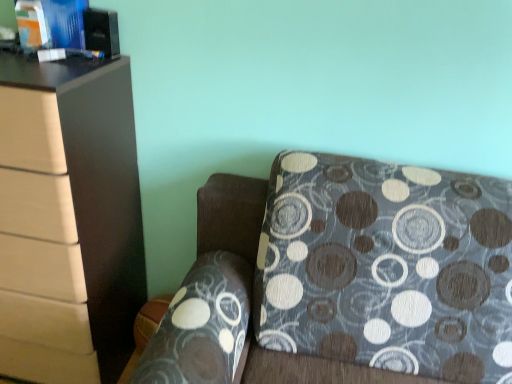
How much space does matte blue book at upper left, which is counted as the 2th book, starting from the right, occupy vertically?

The height of matte blue book at upper left, which is counted as the 2th book, starting from the right, is 5.12 inches.

What is the approximate width of matte blue book at upper left, which appears as the 1th book when viewed from the left?

The width of matte blue book at upper left, which appears as the 1th book when viewed from the left, is 1.79 inches.

Where is `patterned fabric couch at lower right`? patterned fabric couch at lower right is located at coordinates (346, 274).

Locate an element on the screen. The height and width of the screenshot is (384, 512). matte blue book at upper left, which appears as the 1th book when viewed from the left is located at coordinates (32, 25).

From the image's perspective, is blue glossy book at upper left, the 1th book from the right, positioned above or below matte brown chest of drawers at left?

blue glossy book at upper left, the 1th book from the right, is situated higher than matte brown chest of drawers at left in the image.

How different are the orientations of blue glossy book at upper left, the 1th book from the right, and matte brown chest of drawers at left in degrees?

The angle between the facing direction of blue glossy book at upper left, the 1th book from the right, and the facing direction of matte brown chest of drawers at left is 1.19e-05 degrees.

In order to click on the chest of drawers directly beneath the blue glossy book at upper left, the 2th book positioned from the left (from a real-world perspective) in this screenshot , I will do `click(87, 179)`.

Between blue glossy book at upper left, the 2th book positioned from the left, and matte brown chest of drawers at left, which one has larger size?

Bigger between the two is matte brown chest of drawers at left.

Considering the sizes of objects matte blue book at upper left, which appears as the 1th book when viewed from the left, and matte brown chest of drawers at left in the image provided, who is smaller, matte blue book at upper left, which appears as the 1th book when viewed from the left, or matte brown chest of drawers at left?

matte blue book at upper left, which appears as the 1th book when viewed from the left.

Is point (23, 0) farther from camera compared to point (88, 141)?

Yes, it is.

Is matte blue book at upper left, which appears as the 1th book when viewed from the left, far from matte brown chest of drawers at left?

No, there isn't a large distance between matte blue book at upper left, which appears as the 1th book when viewed from the left, and matte brown chest of drawers at left.

Which object is closer to the camera, matte brown chest of drawers at left or patterned fabric couch at lower right?

patterned fabric couch at lower right is closer to the camera.

Is matte brown chest of drawers at left next to patterned fabric couch at lower right and touching it?

No, matte brown chest of drawers at left is not next to patterned fabric couch at lower right.

Which is correct: matte brown chest of drawers at left is inside patterned fabric couch at lower right, or outside of it?

The correct answer is: outside.

From the picture: From a real-world perspective, is matte brown chest of drawers at left physically below patterned fabric couch at lower right?

Incorrect, from a real-world perspective, matte brown chest of drawers at left is higher than patterned fabric couch at lower right.

Based on the photo, can we say blue glossy book at upper left, the 1th book from the right, lies outside matte blue book at upper left, which appears as the 1th book when viewed from the left?

blue glossy book at upper left, the 1th book from the right, lies outside matte blue book at upper left, which appears as the 1th book when viewed from the left,'s area.

Is blue glossy book at upper left, the 2th book positioned from the left, not near matte blue book at upper left, which is counted as the 2th book, starting from the right?

blue glossy book at upper left, the 2th book positioned from the left, is near matte blue book at upper left, which is counted as the 2th book, starting from the right, not far away.

Does blue glossy book at upper left, the 1th book from the right, appear on the left side of matte blue book at upper left, which appears as the 1th book when viewed from the left?

No.

Is blue glossy book at upper left, the 2th book positioned from the left, facing towards matte blue book at upper left, which is counted as the 2th book, starting from the right?

Yes, blue glossy book at upper left, the 2th book positioned from the left, is oriented towards matte blue book at upper left, which is counted as the 2th book, starting from the right.

Find the location of a particular element. Image resolution: width=512 pixels, height=384 pixels. book that is above the matte blue book at upper left, which appears as the 1th book when viewed from the left (from a real-world perspective) is located at coordinates (51, 23).

From the image's perspective, is matte blue book at upper left, which appears as the 1th book when viewed from the left, above or below blue glossy book at upper left, the 2th book positioned from the left?

matte blue book at upper left, which appears as the 1th book when viewed from the left, is situated lower than blue glossy book at upper left, the 2th book positioned from the left, in the image.

Which is behind, matte brown chest of drawers at left or blue glossy book at upper left, the 1th book from the right?

blue glossy book at upper left, the 1th book from the right, is more distant.

From the image's perspective, is matte brown chest of drawers at left positioned above or below blue glossy book at upper left, the 2th book positioned from the left?

From the image's perspective, matte brown chest of drawers at left appears below blue glossy book at upper left, the 2th book positioned from the left.

Is point (53, 94) closer to viewer compared to point (45, 21)?

Yes.

I want to click on furniture below the blue glossy book at upper left, the 1th book from the right (from the image's perspective), so click(x=346, y=274).

Is patterned fabric couch at lower right not inside blue glossy book at upper left, the 1th book from the right?

Indeed, patterned fabric couch at lower right is completely outside blue glossy book at upper left, the 1th book from the right.

Considering the sizes of objects patterned fabric couch at lower right and blue glossy book at upper left, the 2th book positioned from the left, in the image provided, who is wider, patterned fabric couch at lower right or blue glossy book at upper left, the 2th book positioned from the left,?

patterned fabric couch at lower right.

Considering the sizes of objects patterned fabric couch at lower right and blue glossy book at upper left, the 1th book from the right, in the image provided, who is shorter, patterned fabric couch at lower right or blue glossy book at upper left, the 1th book from the right,?

blue glossy book at upper left, the 1th book from the right, is shorter.

Starting from the matte brown chest of drawers at left, which book is the 1st one behind? Please provide its 2D coordinates.

[(51, 23)]

From the matte brown chest of drawers at left, count 1st book to the right and point to it. Please provide its 2D coordinates.

[(32, 25)]

Which object lies further to the anchor point matte blue book at upper left, which is counted as the 2th book, starting from the right, blue glossy book at upper left, the 1th book from the right, or matte brown chest of drawers at left?

The object further to matte blue book at upper left, which is counted as the 2th book, starting from the right, is matte brown chest of drawers at left.

When comparing their distances from blue glossy book at upper left, the 2th book positioned from the left, does matte blue book at upper left, which appears as the 1th book when viewed from the left, or patterned fabric couch at lower right seem closer?

matte blue book at upper left, which appears as the 1th book when viewed from the left.

Looking at the image, which one is located further to matte blue book at upper left, which is counted as the 2th book, starting from the right, patterned fabric couch at lower right or matte brown chest of drawers at left?

patterned fabric couch at lower right.

From the picture: Based on their spatial positions, is matte brown chest of drawers at left or patterned fabric couch at lower right closer to blue glossy book at upper left, the 2th book positioned from the left?

matte brown chest of drawers at left lies closer to blue glossy book at upper left, the 2th book positioned from the left, than the other object.

Consider the image. Looking at the image, which one is located further to matte blue book at upper left, which is counted as the 2th book, starting from the right, blue glossy book at upper left, the 2th book positioned from the left, or patterned fabric couch at lower right?

patterned fabric couch at lower right is further to matte blue book at upper left, which is counted as the 2th book, starting from the right.

Considering their positions, is matte blue book at upper left, which appears as the 1th book when viewed from the left, positioned further to blue glossy book at upper left, the 1th book from the right, than matte brown chest of drawers at left?

matte brown chest of drawers at left is further to blue glossy book at upper left, the 1th book from the right.

Which object lies nearer to the anchor point matte brown chest of drawers at left, patterned fabric couch at lower right or matte blue book at upper left, which is counted as the 2th book, starting from the right?

The object closer to matte brown chest of drawers at left is matte blue book at upper left, which is counted as the 2th book, starting from the right.

Looking at this image, looking at the image, which one is located closer to patterned fabric couch at lower right, matte brown chest of drawers at left or matte blue book at upper left, which appears as the 1th book when viewed from the left?

matte brown chest of drawers at left is positioned closer to the anchor patterned fabric couch at lower right.

What are the coordinates of `book that lies between blue glossy book at upper left, the 1th book from the right, and patterned fabric couch at lower right from top to bottom` in the screenshot? It's located at (32, 25).

Identify the location of book between blue glossy book at upper left, the 2th book positioned from the left, and matte brown chest of drawers at left, in the vertical direction. click(x=32, y=25).